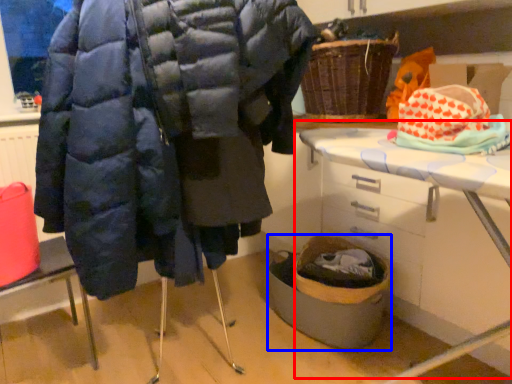
Question: Which of the following is the closest to the observer, table (highlighted by a red box) or basket container (highlighted by a blue box)?

Choices:
 (A) table
 (B) basket container

Answer: (A)